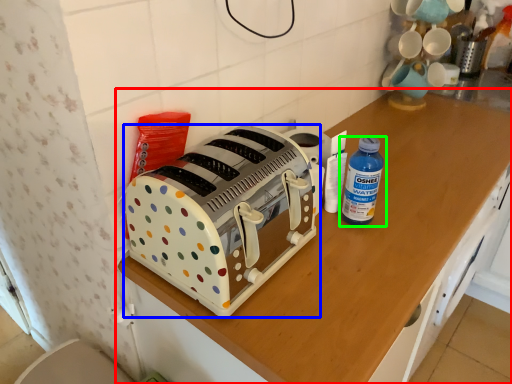
Question: Which object is the farthest from cabinetry (highlighted by a red box)? Choose among these: toaster (highlighted by a blue box) or bottle (highlighted by a green box).

Choices:
 (A) toaster
 (B) bottle

Answer: (B)